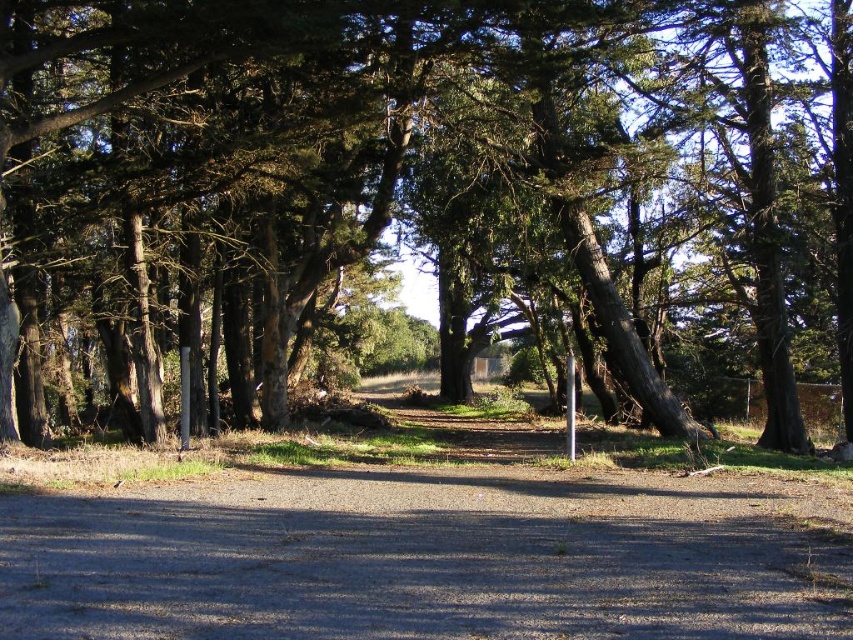
Question: Is green textured tree at center positioned at the back of gray gravel dirt track at center?

Choices:
 (A) no
 (B) yes

Answer: (B)

Question: Which point appears farthest from the camera in this image?

Choices:
 (A) (844, 593)
 (B) (138, 1)

Answer: (B)

Question: Which of the following is the farthest from the observer?

Choices:
 (A) green textured tree at center
 (B) gray gravel dirt track at center

Answer: (A)

Question: Is green textured tree at center closer to camera compared to gray gravel dirt track at center?

Choices:
 (A) no
 (B) yes

Answer: (A)

Question: From the image, what is the correct spatial relationship of green textured tree at center in relation to gray gravel dirt track at center?

Choices:
 (A) right
 (B) left

Answer: (A)